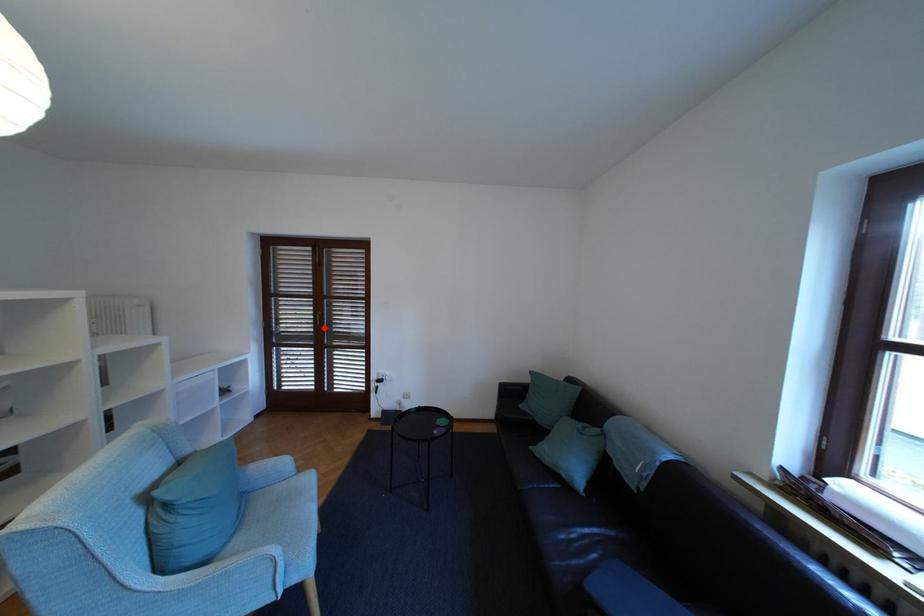
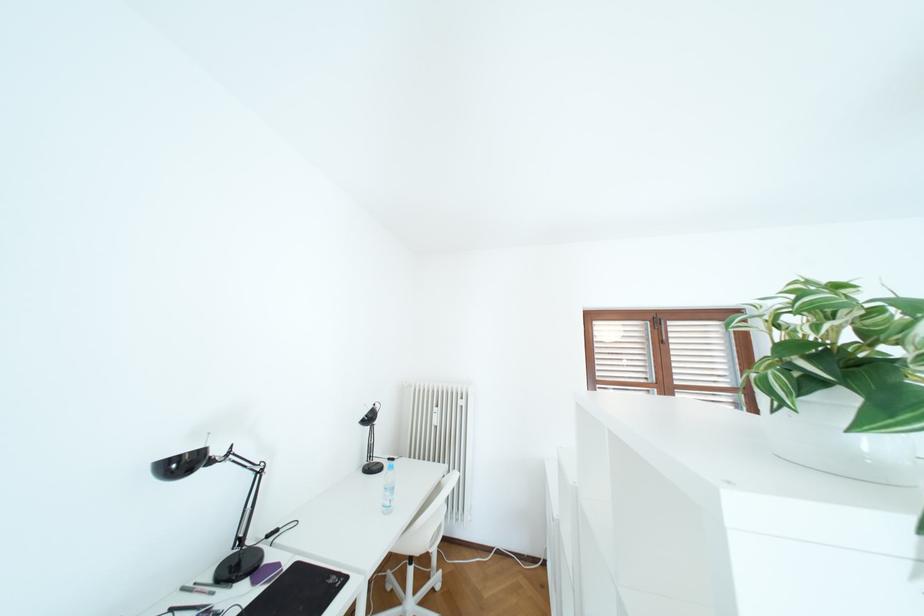
Question: I am providing you with two images of the same scene from different viewpoints. A red point is marked on the first image. Can you still see the location of the red point in image 2?

Choices:
 (A) Yes
 (B) No

Answer: (B)